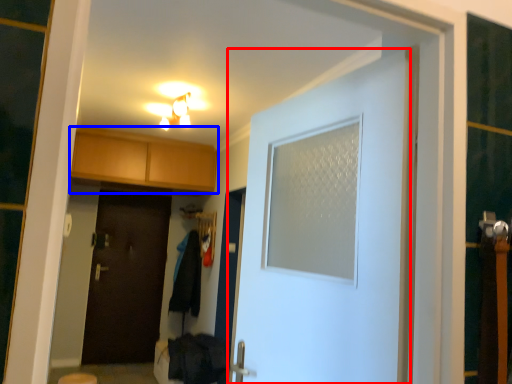
Question: Which point is closer to the camera, door (highlighted by a red box) or cabinetry (highlighted by a blue box)?

Choices:
 (A) door
 (B) cabinetry

Answer: (A)